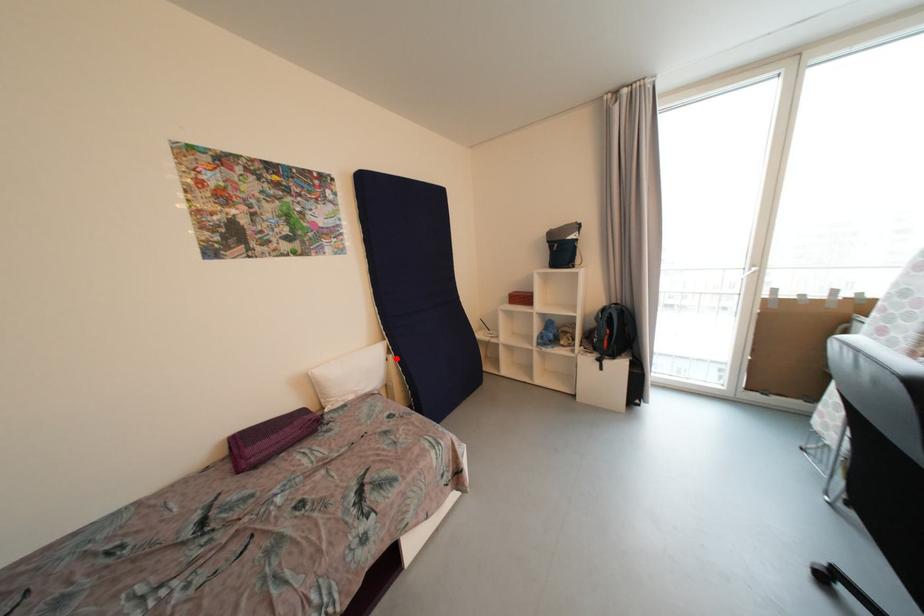
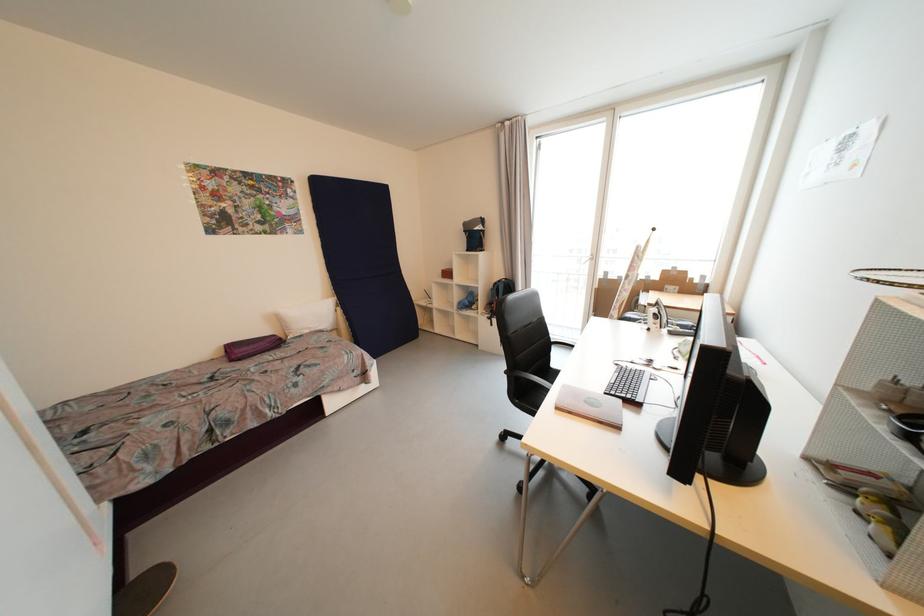
Find the pixel in the second image that matches the highlighted location in the first image.

(344, 310)